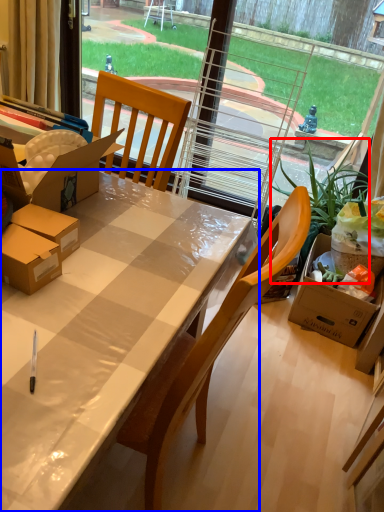
Question: Which object is further to the camera taking this photo, houseplant (highlighted by a red box) or desk (highlighted by a blue box)?

Choices:
 (A) houseplant
 (B) desk

Answer: (A)